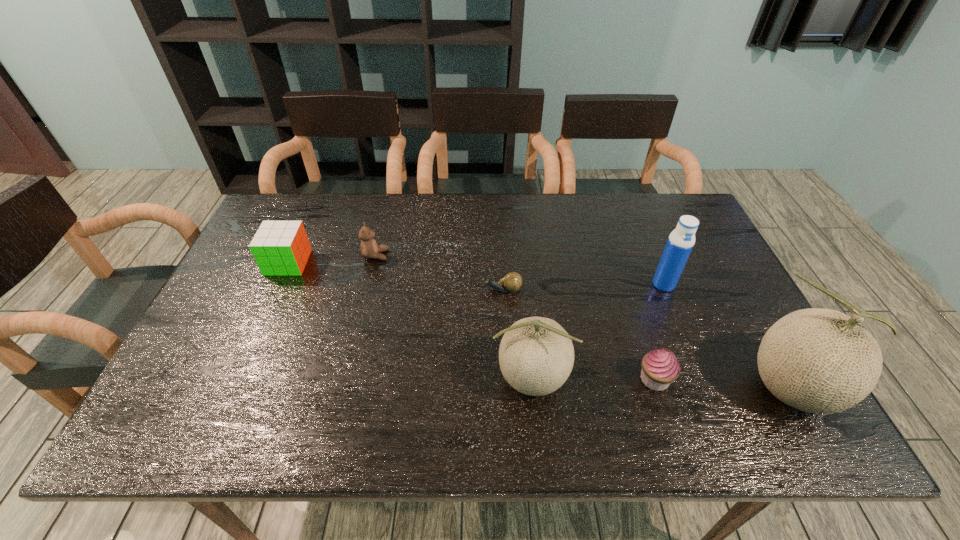
The height and width of the screenshot is (540, 960). What are the coordinates of `object present at the near right corner` in the screenshot? It's located at pyautogui.click(x=822, y=361).

This screenshot has width=960, height=540. I want to click on vacant space at the far edge, so click(447, 195).

At what (x,y) coordinates should I click in order to perform the action: click on free region at the left edge. Please return your answer as a coordinate pair (x, y). The image size is (960, 540). Looking at the image, I should click on (248, 296).

Locate an element on the screen. The image size is (960, 540). free region at the right edge of the desktop is located at coordinates (698, 258).

Identify the location of free space at the far left corner of the desktop. The image size is (960, 540). (277, 216).

In the image, there is a desktop. Find the location of `vacant space at the far right corner`. vacant space at the far right corner is located at coordinates (649, 218).

Find the location of a particular element. The image size is (960, 540). vacant area at the near right corner is located at coordinates (738, 369).

Locate an element on the screen. The image size is (960, 540). free area in between the escargot and the right cantaloup is located at coordinates (647, 339).

Locate an element on the screen. free space between the cupcake and the teddy bear is located at coordinates (515, 318).

I want to click on free space between the cube and the shorter cantaloup, so click(x=409, y=321).